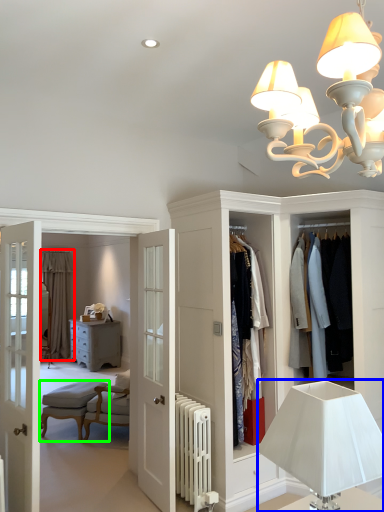
Question: Considering the real-world distances, which object is closest to curtain (highlighted by a red box)? lamp (highlighted by a blue box) or armchair (highlighted by a green box).

Choices:
 (A) lamp
 (B) armchair

Answer: (B)